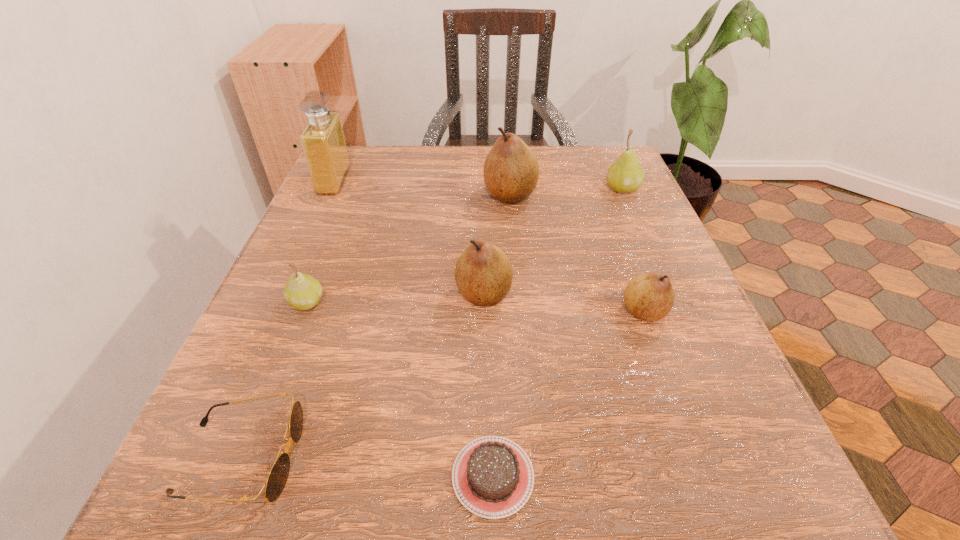
Find the location of a particular element. The image size is (960, 540). vacant space located on the back of the chocolate cake is located at coordinates (491, 354).

In order to click on perfume at the far edge in this screenshot , I will do `click(323, 142)`.

Locate an element on the screen. This screenshot has height=540, width=960. sunglasses at the near edge is located at coordinates (278, 475).

Image resolution: width=960 pixels, height=540 pixels. Find the location of `chocolate cake at the near edge`. chocolate cake at the near edge is located at coordinates (492, 476).

Image resolution: width=960 pixels, height=540 pixels. Find the location of `perfume situated at the left edge`. perfume situated at the left edge is located at coordinates (323, 142).

At what (x,y) coordinates should I click in order to perform the action: click on pear at the left edge. Please return your answer as a coordinate pair (x, y). This screenshot has width=960, height=540. Looking at the image, I should click on (302, 291).

Locate an element on the screen. sunglasses located in the left edge section of the desktop is located at coordinates pyautogui.click(x=278, y=475).

The width and height of the screenshot is (960, 540). Find the location of `object at the far left corner`. object at the far left corner is located at coordinates (323, 142).

Locate an element on the screen. This screenshot has height=540, width=960. object that is at the near left corner is located at coordinates (278, 475).

At what (x,y) coordinates should I click in order to perform the action: click on object that is at the far right corner. Please return your answer as a coordinate pair (x, y). Looking at the image, I should click on (626, 175).